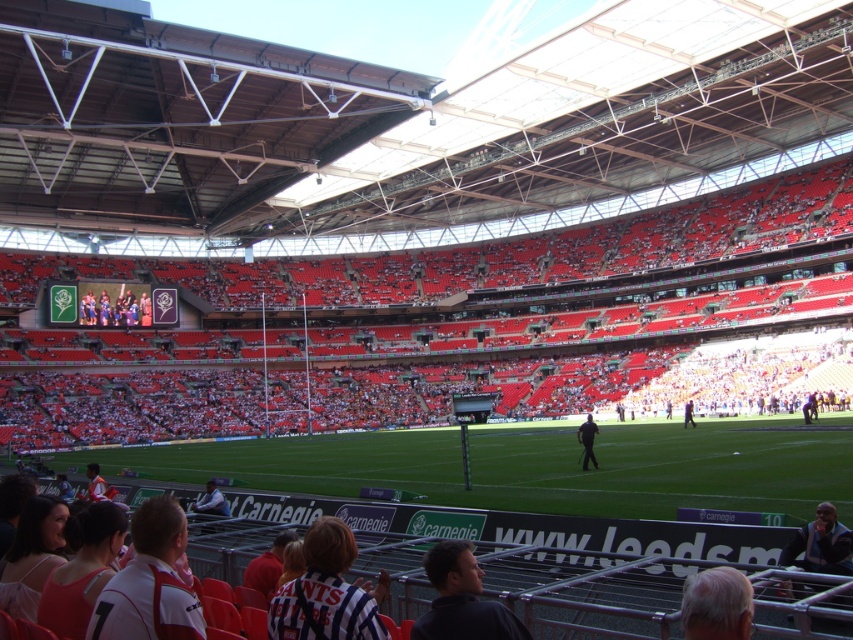
Question: From the image, what is the correct spatial relationship of gray hair at lower right in relation to white fabric shirt at lower center?

Choices:
 (A) below
 (B) above

Answer: (B)

Question: Which of the following is the closest to the observer?

Choices:
 (A) striped jersey at lower center
 (B) gray hair at lower right
 (C) white fabric shirt at lower center
 (D) black matte person at center

Answer: (B)

Question: Which is farther from the matte black jacket at upper center?

Choices:
 (A) light brown leather jacket at center
 (B) orange jersey at lower left

Answer: (A)

Question: Is the position of striped jersey at lower center less distant than that of white fabric shirt at lower center?

Choices:
 (A) no
 (B) yes

Answer: (B)

Question: Where is matte black jacket at upper center located in relation to orange jersey at lower left in the image?

Choices:
 (A) above
 (B) below

Answer: (A)

Question: Which object is closer to the camera taking this photo?

Choices:
 (A) white jersey at lower left
 (B) matte black jacket at upper center

Answer: (A)